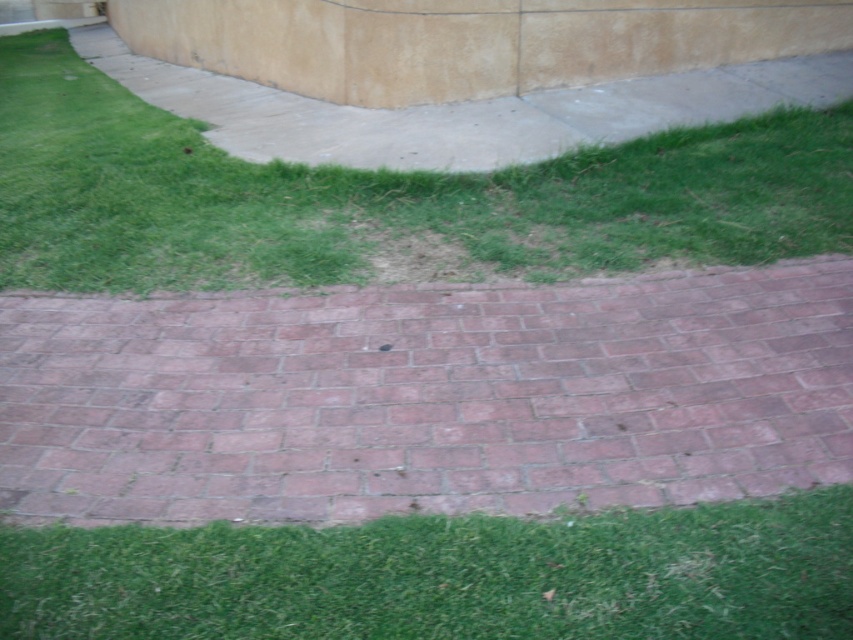
Question: Which point is closer to the camera taking this photo?

Choices:
 (A) (827, 490)
 (B) (544, 348)
 (C) (186, 234)

Answer: (A)

Question: Estimate the real-world distances between objects in this image. Which object is farther from the green grass at center?

Choices:
 (A) green grass at lower center
 (B) red brick at center

Answer: (A)

Question: Can you confirm if red brick at center is thinner than green grass at center?

Choices:
 (A) no
 (B) yes

Answer: (A)

Question: Is the position of red brick at center less distant than that of green grass at center?

Choices:
 (A) yes
 (B) no

Answer: (A)

Question: Is green grass at center closer to camera compared to green grass at lower center?

Choices:
 (A) yes
 (B) no

Answer: (B)

Question: Which object is positioned closest to the green grass at center?

Choices:
 (A) red brick at center
 (B) green grass at lower center

Answer: (A)